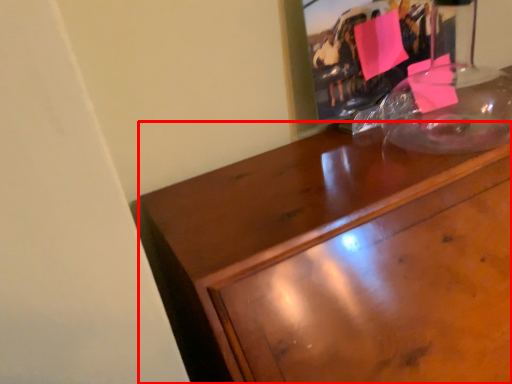
Question: Observing the image, what is the correct spatial positioning of desk (annotated by the red box) in reference to picture frame?

Choices:
 (A) right
 (B) left

Answer: (A)